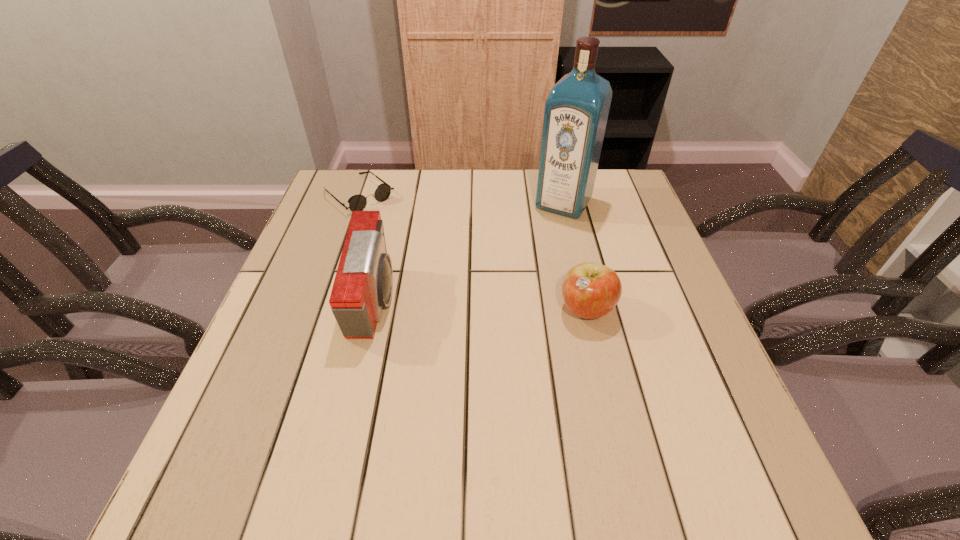
Where is `vacant space at the left edge of the desktop`? The height and width of the screenshot is (540, 960). vacant space at the left edge of the desktop is located at coordinates [x=280, y=350].

At what (x,y) coordinates should I click in order to perform the action: click on vacant region at the right edge of the desktop. Please return your answer as a coordinate pair (x, y). This screenshot has height=540, width=960. Looking at the image, I should click on (646, 256).

This screenshot has height=540, width=960. In the image, there is a desktop. Find the location of `free space at the far left corner`. free space at the far left corner is located at coordinates (332, 177).

Find the location of `vacant space at the far right corner`. vacant space at the far right corner is located at coordinates (612, 213).

Identify the location of free space at the near right corner. (668, 404).

I want to click on empty space that is in between the tallest object and the sunglasses, so click(461, 199).

This screenshot has width=960, height=540. I want to click on vacant region between the second shortest object and the tallest object, so click(575, 256).

Locate an element on the screen. vacant area that lies between the camera and the second shortest object is located at coordinates (481, 306).

Identify the location of blank region between the liquor and the camera. click(x=469, y=253).

What are the coordinates of `vacant point located between the tallest object and the apple` in the screenshot? It's located at (575, 256).